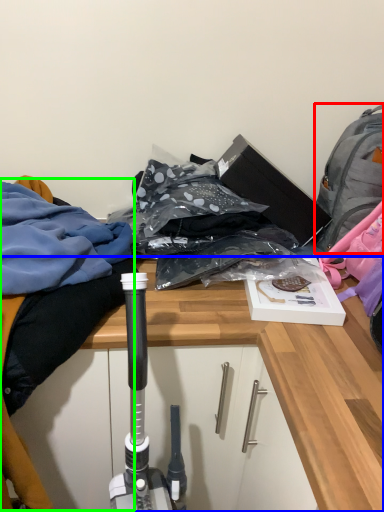
Question: Based on their relative distances, which object is nearer to backpack (highlighted by a red box)? Choose from desk (highlighted by a blue box) and clothing (highlighted by a green box).

Choices:
 (A) desk
 (B) clothing

Answer: (A)